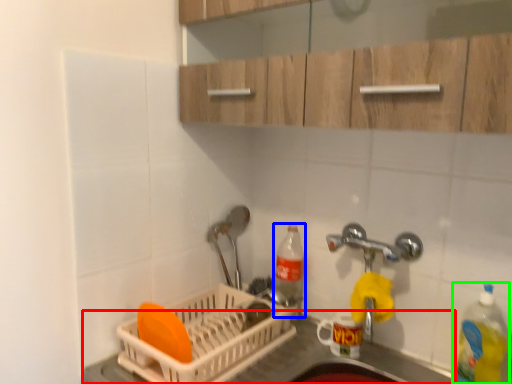
Question: Considering the real-world distances, which object is farthest from counter top (highlighted by a red box)? bottle (highlighted by a blue box) or bottle (highlighted by a green box)?

Choices:
 (A) bottle
 (B) bottle

Answer: (B)